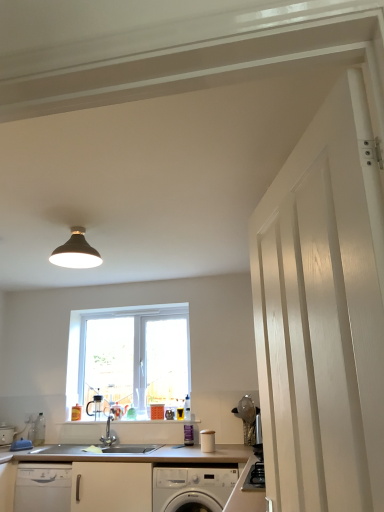
Question: In the image, is white plastic window at center positioned in front of or behind wooden countertop at lower left?

Choices:
 (A) front
 (B) behind

Answer: (B)

Question: From a real-world perspective, is white plastic window at center physically located above or below wooden countertop at lower left?

Choices:
 (A) below
 (B) above

Answer: (B)

Question: Estimate the real-world distances between objects in this image. Which object is farther from the white plastic window at center?

Choices:
 (A) matte black light fixture at upper center
 (B) satin nickel faucet at center
 (C) wooden countertop at lower left
 (D) white wood door at right
 (E) white glossy washing machine at lower center

Answer: (D)

Question: Based on their relative distances, which object is farther from the white wood door at right?

Choices:
 (A) satin nickel faucet at center
 (B) white glossy washing machine at lower center
 (C) wooden countertop at lower left
 (D) white plastic window at center
 (E) matte black light fixture at upper center

Answer: (A)